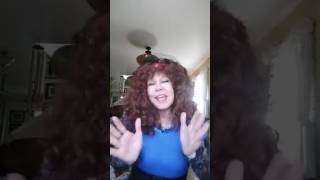
This screenshot has width=320, height=180. In order to click on window in this screenshot , I will do `click(198, 81)`.